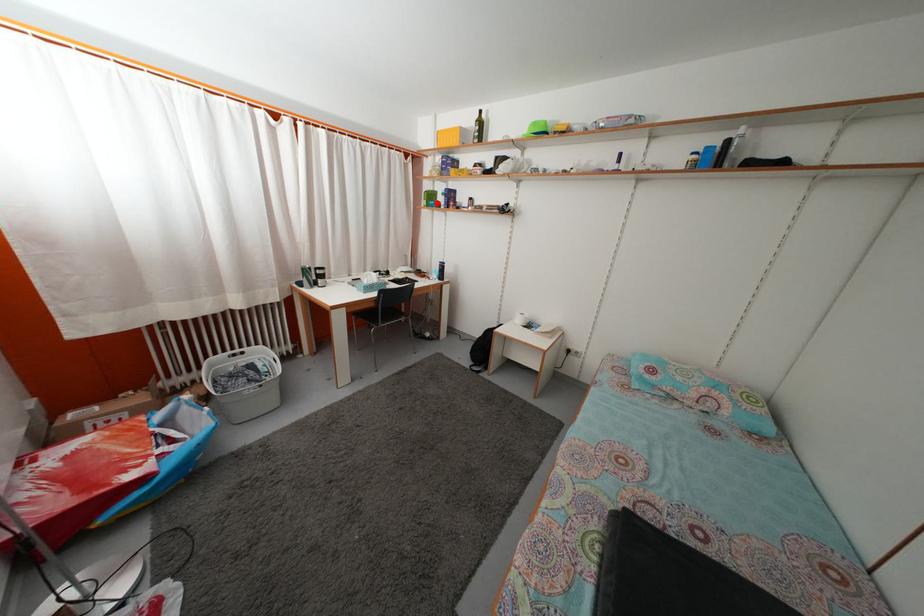
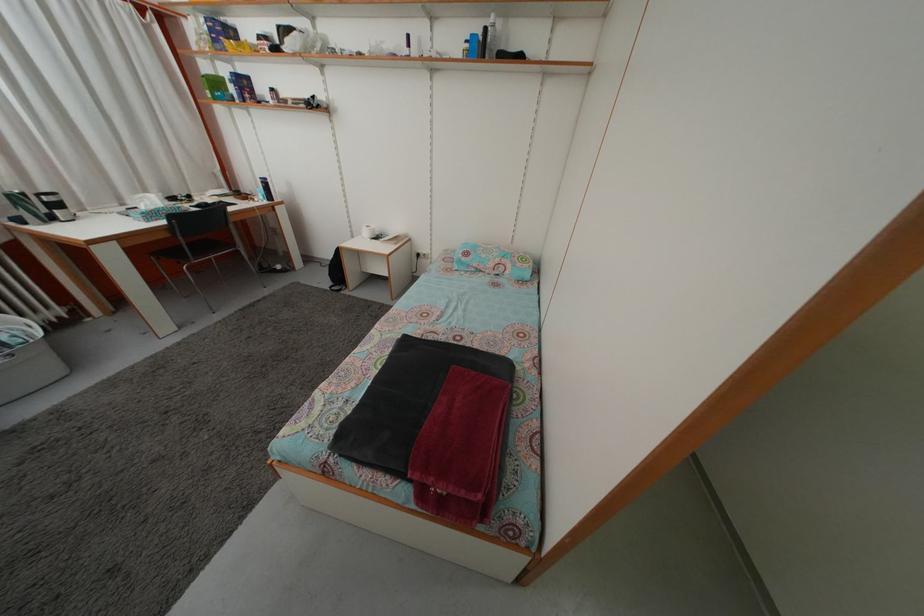
Locate, in the second image, the point that corresponds to the highlighted location in the first image.

(223, 91)